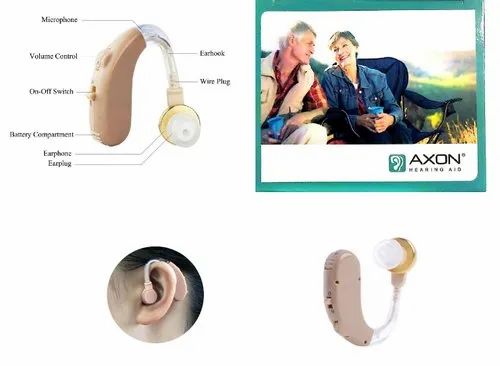
In order to click on on/off switch in this screenshot , I will do `click(93, 97)`, `click(326, 301)`.